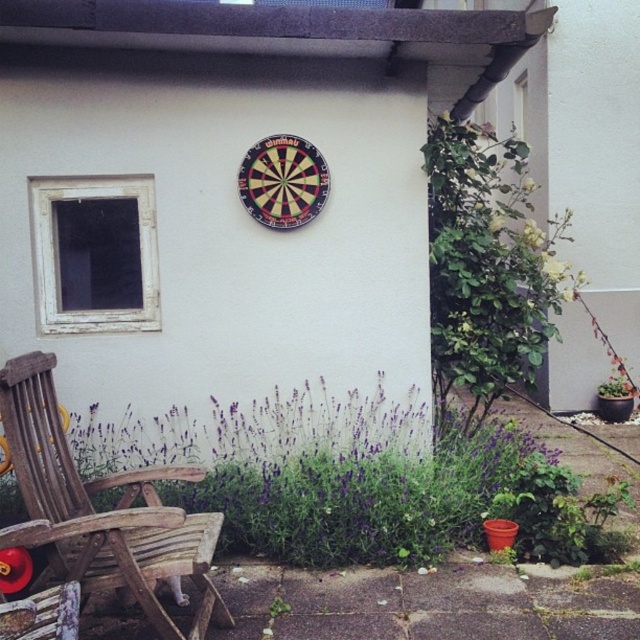
You are standing on the patio and want to throw a dart at the dartboard. There are two points marked on the dartboard. Which point is closer to you, point [328,472] or point [160,550]?

Point [160,550] is closer to you because it is in front of point [328,472].

You are planning to place a small decorative pot on the patio. You have two options near you, the purple wood lavender at lower center and the wooden rocking chair at lower left. Which object should you place the pot under for shade?

The purple wood lavender at lower center is positioned under the wooden rocking chair at lower left, so placing the pot under the wooden rocking chair at lower left would provide shade from the lavender.